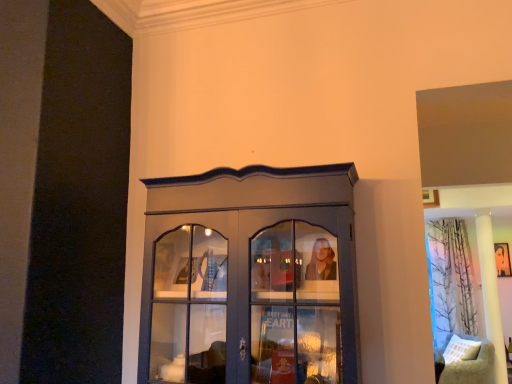
Question: From the image's perspective, does matte gray cupboard at center appear higher than printed fabric curtain at right?

Choices:
 (A) yes
 (B) no

Answer: (A)

Question: Is matte gray cupboard at center next to printed fabric curtain at right?

Choices:
 (A) yes
 (B) no

Answer: (B)

Question: Does matte gray cupboard at center have a larger size compared to printed fabric curtain at right?

Choices:
 (A) yes
 (B) no

Answer: (A)

Question: Does matte gray cupboard at center have a greater height compared to printed fabric curtain at right?

Choices:
 (A) no
 (B) yes

Answer: (A)

Question: Is matte gray cupboard at center outside printed fabric curtain at right?

Choices:
 (A) no
 (B) yes

Answer: (B)

Question: From a real-world perspective, is matte gray cupboard at center over printed fabric curtain at right?

Choices:
 (A) no
 (B) yes

Answer: (B)

Question: Is printed fabric curtain at right oriented towards smooth black portrait at upper right?

Choices:
 (A) yes
 (B) no

Answer: (B)

Question: Is printed fabric curtain at right wider than smooth black portrait at upper right?

Choices:
 (A) yes
 (B) no

Answer: (A)

Question: From the image's perspective, does printed fabric curtain at right appear higher than smooth black portrait at upper right?

Choices:
 (A) yes
 (B) no

Answer: (B)

Question: Considering the relative positions of printed fabric curtain at right and smooth black portrait at upper right in the image provided, is printed fabric curtain at right to the right of smooth black portrait at upper right from the viewer's perspective?

Choices:
 (A) no
 (B) yes

Answer: (A)

Question: Is printed fabric curtain at right at the left side of smooth black portrait at upper right?

Choices:
 (A) no
 (B) yes

Answer: (B)

Question: Is the depth of printed fabric curtain at right greater than that of smooth black portrait at upper right?

Choices:
 (A) yes
 (B) no

Answer: (B)

Question: Can you confirm if matte gray cupboard at center is taller than smooth black portrait at upper right?

Choices:
 (A) yes
 (B) no

Answer: (A)